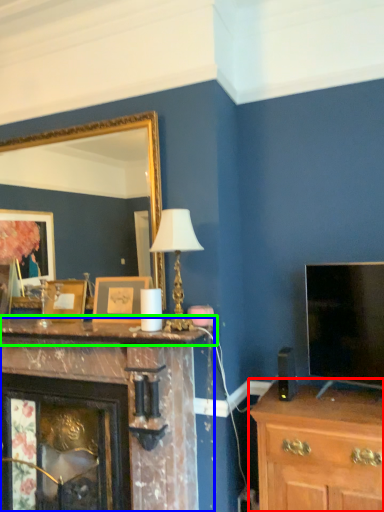
Question: Based on their relative distances, which object is farther from chest of drawers (highlighted by a red box)? Choose from fireplace (highlighted by a blue box) and mantle (highlighted by a green box).

Choices:
 (A) fireplace
 (B) mantle

Answer: (A)